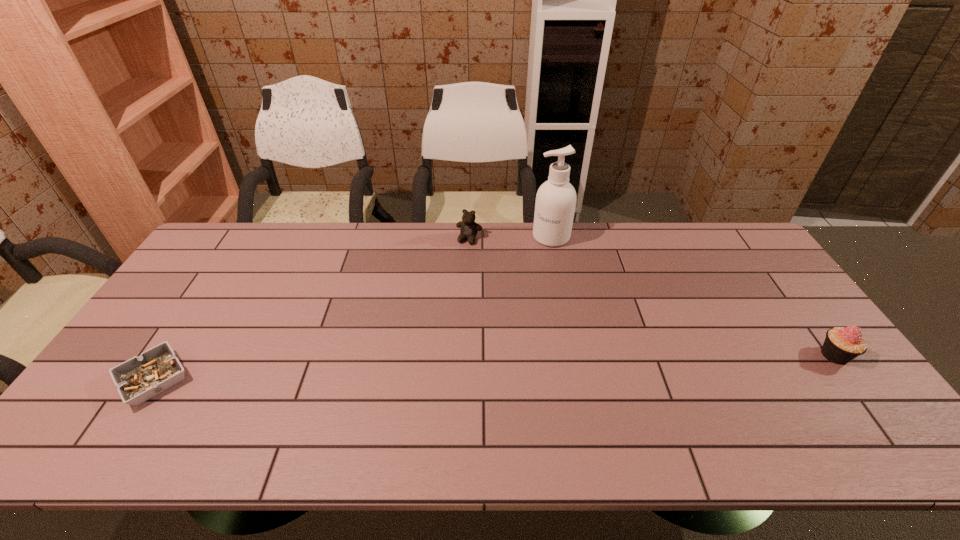
Locate an element on the screen. The height and width of the screenshot is (540, 960). free point between the leftmost object and the tallest object is located at coordinates (352, 308).

Identify the location of free space between the teddy bear and the cupcake. This screenshot has width=960, height=540. (652, 297).

The width and height of the screenshot is (960, 540). Find the location of `free area in between the cupcake and the third object from right to left`. free area in between the cupcake and the third object from right to left is located at coordinates (652, 297).

Identify the location of vacant space that is in between the rightmost object and the shortest object. The height and width of the screenshot is (540, 960). (494, 367).

You are a GUI agent. You are given a task and a screenshot of the screen. Output one action in this format:
    pyautogui.click(x=<x>, y=<y>)
    Task: Click on the empty location between the cleansing agent and the leftmost object
    This screenshot has width=960, height=540.
    Given the screenshot: What is the action you would take?
    pyautogui.click(x=352, y=308)

Locate an element on the screen. the second closest object to the ashtray is located at coordinates (555, 204).

Point out which object is positioned as the second nearest to the cupcake. Please provide its 2D coordinates. Your answer should be formatted as a tuple, i.e. [(x, y)], where the tuple contains the x and y coordinates of a point satisfying the conditions above.

[(468, 227)]

You are a GUI agent. You are given a task and a screenshot of the screen. Output one action in this format:
    pyautogui.click(x=<x>, y=<y>)
    Task: Click on the vacant space that satisfies the following two spatial constraints: 1. on the back side of the shortest object; 2. on the left side of the third object from right to left
    
    Given the screenshot: What is the action you would take?
    pyautogui.click(x=246, y=239)

Image resolution: width=960 pixels, height=540 pixels. Find the location of `vacant space that satisfies the following two spatial constraints: 1. on the back side of the cupcake; 2. on the left side of the ashtray`. vacant space that satisfies the following two spatial constraints: 1. on the back side of the cupcake; 2. on the left side of the ashtray is located at coordinates (170, 355).